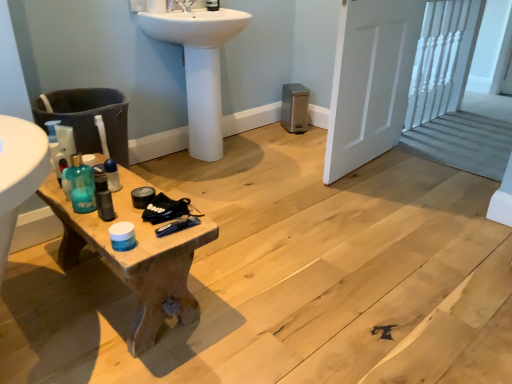
Find the location of a particular element. This screenshot has width=512, height=384. vacant space underneath white wooden door at right (from a real-world perspective) is located at coordinates (364, 162).